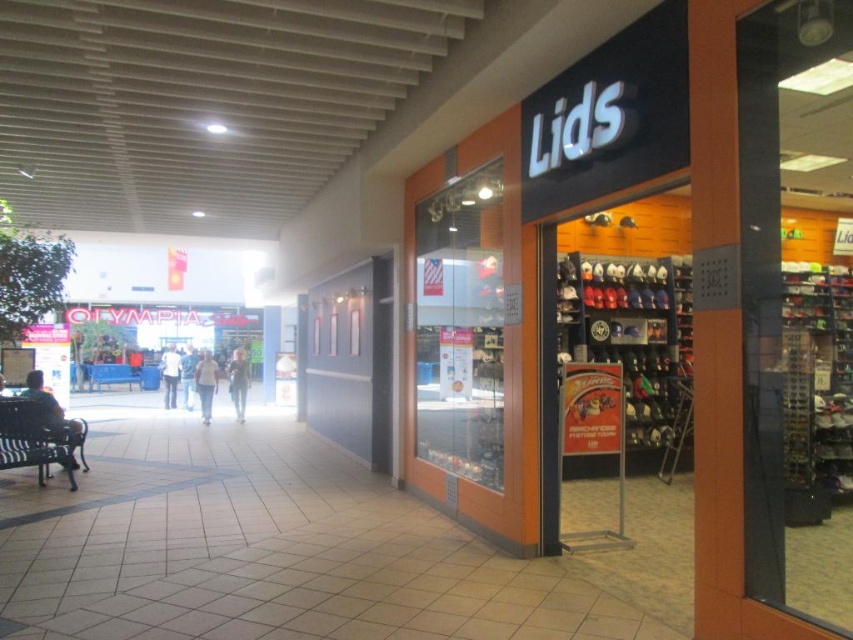
Question: Where is black metal bench at left located in relation to blue fabric park bench at left in the image?

Choices:
 (A) right
 (B) left

Answer: (A)

Question: Observing the image, what is the correct spatial positioning of black metal bench at left in reference to blue fabric park bench at left?

Choices:
 (A) left
 (B) right

Answer: (B)

Question: Can you confirm if black metal bench at left is positioned below blue fabric park bench at left?

Choices:
 (A) no
 (B) yes

Answer: (A)

Question: Which point is closer to the camera?

Choices:
 (A) (18, 426)
 (B) (106, 371)

Answer: (A)